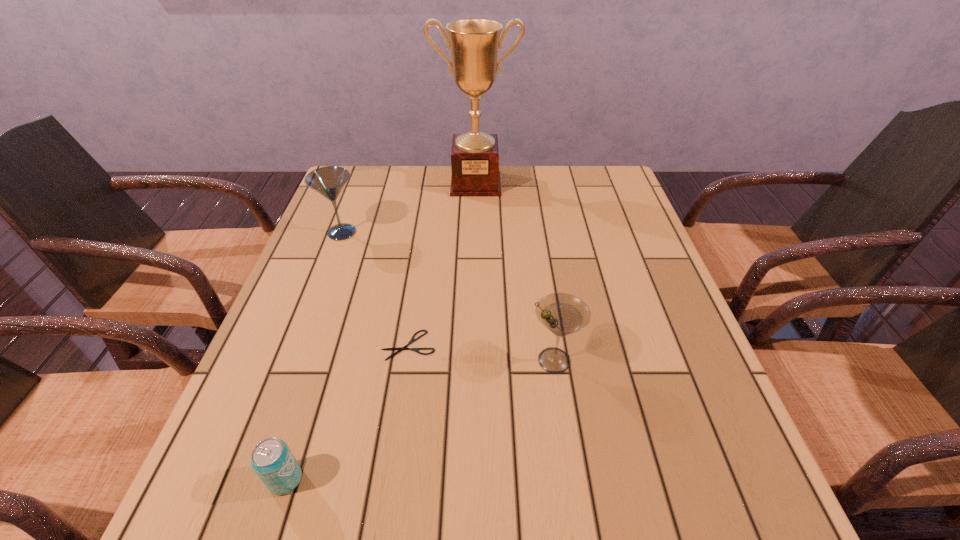
In order to click on vacant space at the right edge in this screenshot , I will do `click(652, 403)`.

I want to click on vacant space at the near left corner of the desktop, so click(295, 504).

The height and width of the screenshot is (540, 960). Identify the location of vacant space at the far right corner of the desktop. (593, 168).

The image size is (960, 540). In the image, there is a desktop. What are the coordinates of `vacant area at the near right corner` in the screenshot? It's located at (697, 515).

This screenshot has height=540, width=960. Identify the location of vacant space that is in between the shortest object and the farthest object. (442, 264).

Find the location of `free space between the farthest object and the nearer martini`. free space between the farthest object and the nearer martini is located at coordinates (515, 272).

Where is `unoccupied area between the farther martini and the shortest object`? unoccupied area between the farther martini and the shortest object is located at coordinates (375, 289).

Identify the location of unoccupied area between the second farthest object and the tallest object. (409, 208).

The height and width of the screenshot is (540, 960). Find the location of `vacant area between the left martini and the right martini`. vacant area between the left martini and the right martini is located at coordinates (447, 296).

The image size is (960, 540). I want to click on empty space that is in between the tallest object and the nearest object, so click(380, 331).